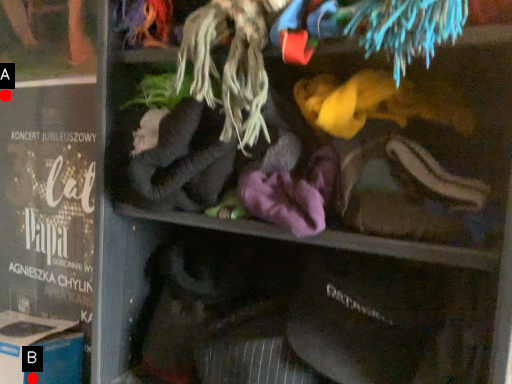
Question: Two points are circled on the image, labeled by A and B beside each circle. Which point is further to the camera?

Choices:
 (A) A is further
 (B) B is further

Answer: (A)